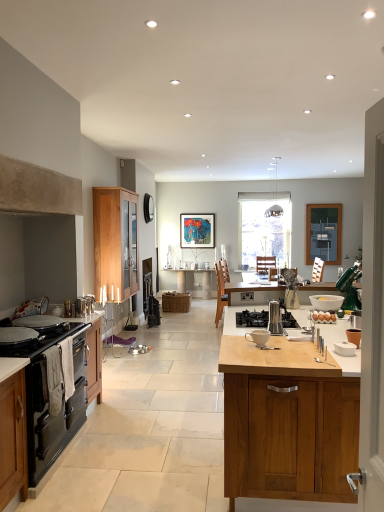
Question: Should I look upward or downward to see green metallic stand mixer at right, the 6th appliance from the left?

Choices:
 (A) down
 (B) up

Answer: (A)

Question: Is white ceramic cup at center not within satin silver coffee maker at center, acting as the second appliance starting from the right?

Choices:
 (A) no
 (B) yes

Answer: (B)

Question: Can you confirm if white ceramic cup at center is shorter than satin silver coffee maker at center, the first appliance in the back-to-front sequence?

Choices:
 (A) yes
 (B) no

Answer: (A)

Question: Is there a large distance between white ceramic cup at center and satin silver coffee maker at center, which is counted as the sixth appliance, starting from the front?

Choices:
 (A) yes
 (B) no

Answer: (A)

Question: From the image's perspective, would you say white ceramic cup at center is shown under satin silver coffee maker at center, the fifth appliance viewed from the left?

Choices:
 (A) yes
 (B) no

Answer: (A)

Question: Does white ceramic cup at center come behind satin silver coffee maker at center, the first appliance in the back-to-front sequence?

Choices:
 (A) yes
 (B) no

Answer: (B)

Question: Can you see white ceramic cup at center touching satin silver coffee maker at center, which is counted as the sixth appliance, starting from the front?

Choices:
 (A) no
 (B) yes

Answer: (A)

Question: Considering the relative sizes of stainless steel gas stove at center, the 2th gas stove from the left, and green metallic stand mixer at right, which is the 2th appliance in back-to-front order, in the image provided, is stainless steel gas stove at center, the 2th gas stove from the left, thinner than green metallic stand mixer at right, which is the 2th appliance in back-to-front order,?

Choices:
 (A) no
 (B) yes

Answer: (A)

Question: From a real-world perspective, is stainless steel gas stove at center, the 1th gas stove viewed from the right, located beneath green metallic stand mixer at right, the first appliance viewed from the right?

Choices:
 (A) yes
 (B) no

Answer: (A)

Question: Does stainless steel gas stove at center, the 2th gas stove from the left, lie in front of green metallic stand mixer at right, the first appliance viewed from the right?

Choices:
 (A) no
 (B) yes

Answer: (B)

Question: Is stainless steel gas stove at center, the 1th gas stove viewed from the right, facing towards green metallic stand mixer at right, the fifth appliance from the front?

Choices:
 (A) yes
 (B) no

Answer: (B)

Question: Is stainless steel gas stove at center, the 1th gas stove viewed from the right, wider than green metallic stand mixer at right, the first appliance viewed from the right?

Choices:
 (A) yes
 (B) no

Answer: (A)

Question: Does stainless steel gas stove at center, the 2th gas stove from the left, have a smaller size compared to green metallic stand mixer at right, the first appliance viewed from the right?

Choices:
 (A) no
 (B) yes

Answer: (B)

Question: Can you confirm if black matte oven at left, which appears as the 2th cabinetry when viewed from the front, is positioned to the left of woven brown picnic basket at center?

Choices:
 (A) yes
 (B) no

Answer: (A)